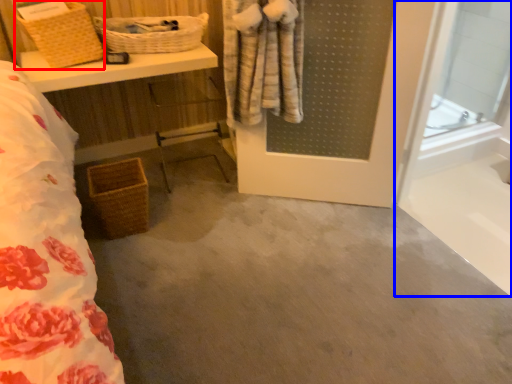
Question: Among these objects, which one is nearest to the camera, basket (highlighted by a red box) or glass door (highlighted by a blue box)?

Choices:
 (A) basket
 (B) glass door

Answer: (B)